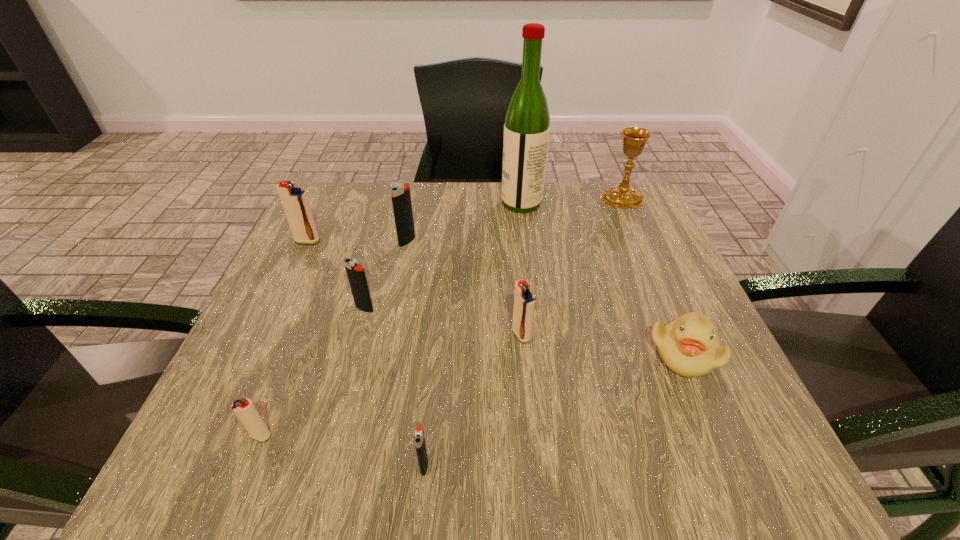
Where is `duckling located at the right edge`? duckling located at the right edge is located at coordinates (687, 345).

This screenshot has width=960, height=540. I want to click on object that is at the far left corner, so click(x=295, y=203).

Where is `object located at the near left corner`? object located at the near left corner is located at coordinates (245, 411).

Locate an element on the screen. This screenshot has height=540, width=960. object at the far right corner is located at coordinates (x=621, y=195).

The image size is (960, 540). In order to click on vacant point at the far edge in this screenshot , I will do `click(471, 198)`.

Find the location of a particular element. The image size is (960, 540). vacant space at the near edge is located at coordinates (428, 451).

Where is `vacant space at the left edge`? vacant space at the left edge is located at coordinates (267, 363).

The height and width of the screenshot is (540, 960). In order to click on vacant space at the right edge in this screenshot , I will do `click(699, 409)`.

In the image, there is a desktop. Identify the location of vacant space at the far left corner. (346, 192).

The height and width of the screenshot is (540, 960). I want to click on free point at the near left corner, so click(269, 479).